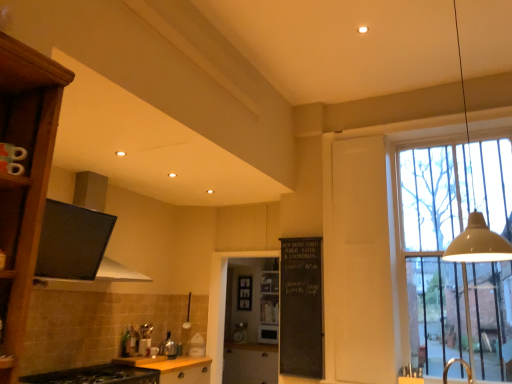
Question: Can you confirm if matte wood cabinet at center, which is the third cabinetry from front to back, is taller than yellow matte cabinet at lower center, positioned as the 2th cabinetry in top-to-bottom order?

Choices:
 (A) yes
 (B) no

Answer: (A)

Question: Considering the relative sizes of matte wood cabinet at center, which is the third cabinetry from front to back, and yellow matte cabinet at lower center, positioned as the 2th cabinetry in top-to-bottom order, in the image provided, is matte wood cabinet at center, which is the third cabinetry from front to back, bigger than yellow matte cabinet at lower center, positioned as the 2th cabinetry in top-to-bottom order,?

Choices:
 (A) no
 (B) yes

Answer: (B)

Question: Would you consider matte wood cabinet at center, marked as the 1th cabinetry in a back-to-front arrangement, to be distant from yellow matte cabinet at lower center, which ranks as the second cabinetry in back-to-front order?

Choices:
 (A) no
 (B) yes

Answer: (B)

Question: From a real-world perspective, is matte wood cabinet at center, acting as the first cabinetry starting from the bottom, under yellow matte cabinet at lower center, positioned as the 2th cabinetry in top-to-bottom order?

Choices:
 (A) no
 (B) yes

Answer: (B)

Question: Can you confirm if matte wood cabinet at center, acting as the third cabinetry starting from the top, is positioned to the right of yellow matte cabinet at lower center, which appears as the second cabinetry when viewed from the front?

Choices:
 (A) no
 (B) yes

Answer: (B)

Question: Does matte wood cabinet at center, marked as the 1th cabinetry in a back-to-front arrangement, have a lesser width compared to yellow matte cabinet at lower center, placed as the second cabinetry when sorted from bottom to top?

Choices:
 (A) no
 (B) yes

Answer: (A)

Question: From a real-world perspective, is black chalkboard at center physically below transparent glass screen door at center?

Choices:
 (A) yes
 (B) no

Answer: (B)

Question: Would you say transparent glass screen door at center is part of black chalkboard at center's contents?

Choices:
 (A) no
 (B) yes

Answer: (A)

Question: Does black chalkboard at center touch transparent glass screen door at center?

Choices:
 (A) no
 (B) yes

Answer: (A)

Question: Is black chalkboard at center to the right of transparent glass screen door at center from the viewer's perspective?

Choices:
 (A) no
 (B) yes

Answer: (B)

Question: Can you confirm if black chalkboard at center is shorter than transparent glass screen door at center?

Choices:
 (A) no
 (B) yes

Answer: (B)

Question: Is black chalkboard at center far from transparent glass screen door at center?

Choices:
 (A) no
 (B) yes

Answer: (B)

Question: From the image's perspective, is beige matte pendant lamp at upper right under black chalkboard at center?

Choices:
 (A) no
 (B) yes

Answer: (A)